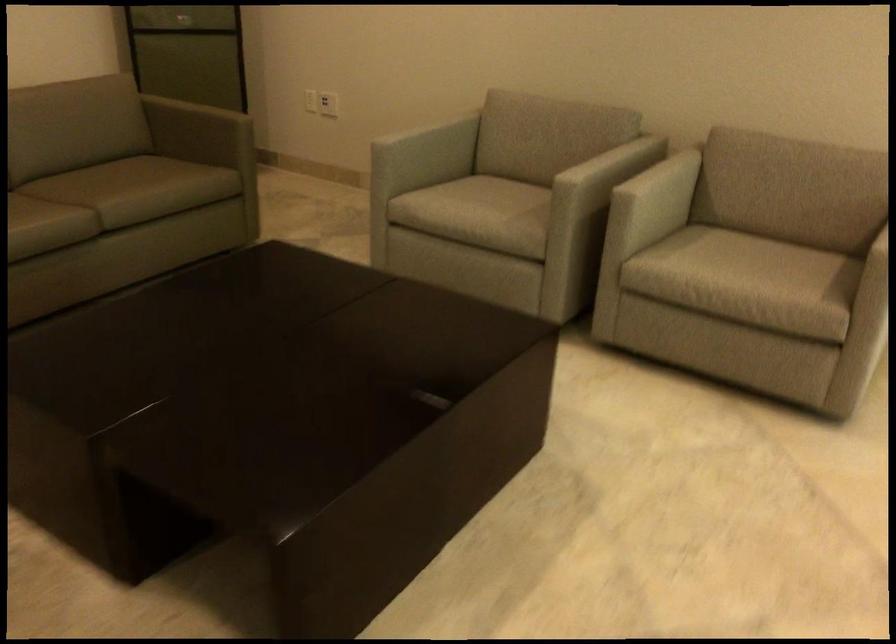
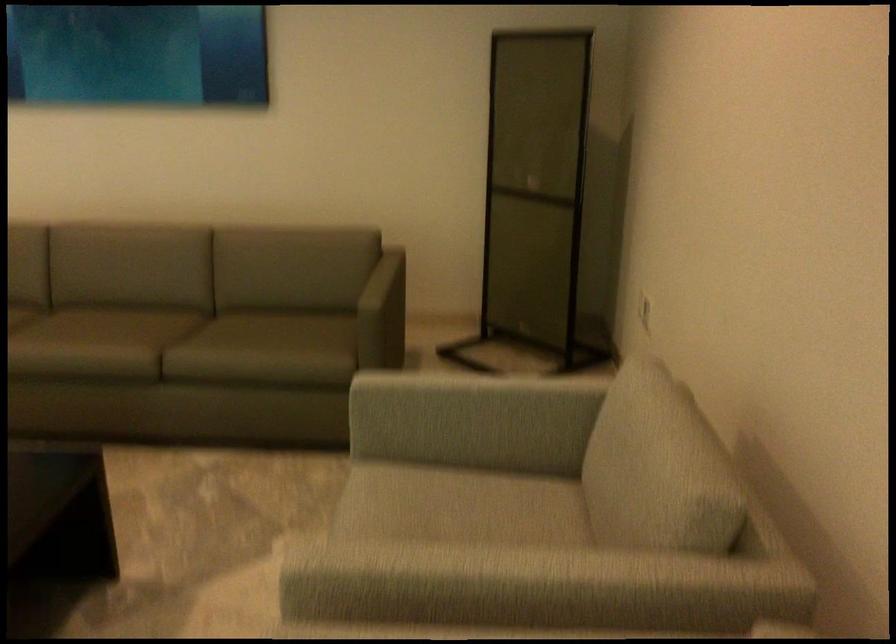
In the second image, find the point that corresponds to (x=565, y=109) in the first image.

(653, 451)